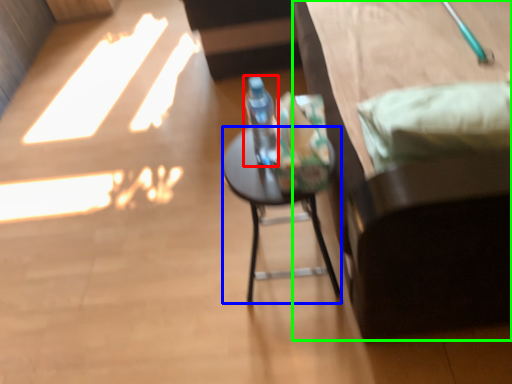
Question: Which is farther away from bottle (highlighted by a red box)? desk (highlighted by a blue box) or furniture (highlighted by a green box)?

Choices:
 (A) desk
 (B) furniture

Answer: (B)